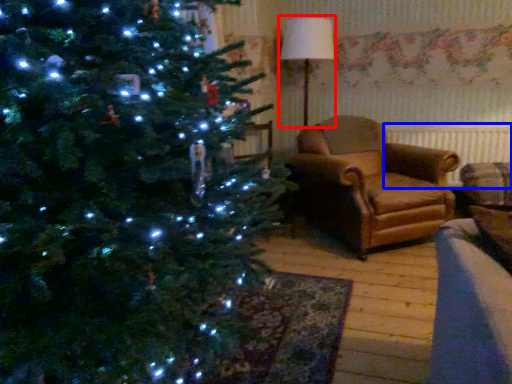
Question: Among these objects, which one is farthest to the camera, lamp (highlighted by a red box) or radiator (highlighted by a blue box)?

Choices:
 (A) lamp
 (B) radiator

Answer: (B)